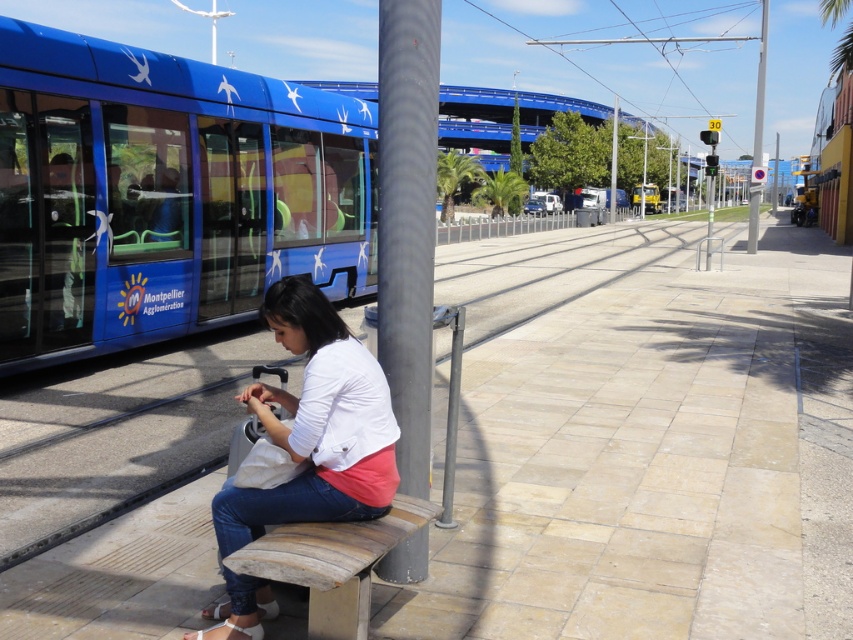
Who is taller, white cotton shirt at center or metallic pole at upper right?

Standing taller between the two is metallic pole at upper right.

Measure the distance between point [346,381] and camera.

Point [346,381] is 2.84 meters from camera.

Does point (264, 422) come behind point (757, 131)?

No, (264, 422) is in front of (757, 131).

This screenshot has width=853, height=640. I want to click on white cotton shirt at center, so click(316, 426).

Who is taller, black textured pole at center or metallic pole at center?

Standing taller between the two is metallic pole at center.

Is black textured pole at center shorter than metallic pole at center?

Correct, black textured pole at center is not as tall as metallic pole at center.

This screenshot has height=640, width=853. What are the coordinates of `black textured pole at center` in the screenshot? It's located at (407, 221).

The height and width of the screenshot is (640, 853). What do you see at coordinates (334, 563) in the screenshot? I see `wooden bench at center` at bounding box center [334, 563].

Is wooden bench at center bigger than metallic pole at center?

Incorrect, wooden bench at center is not larger than metallic pole at center.

Who is more distant from viewer, (323, 563) or (612, 198)?

Point (612, 198)

Where is `wooden bench at center`? wooden bench at center is located at coordinates (334, 563).